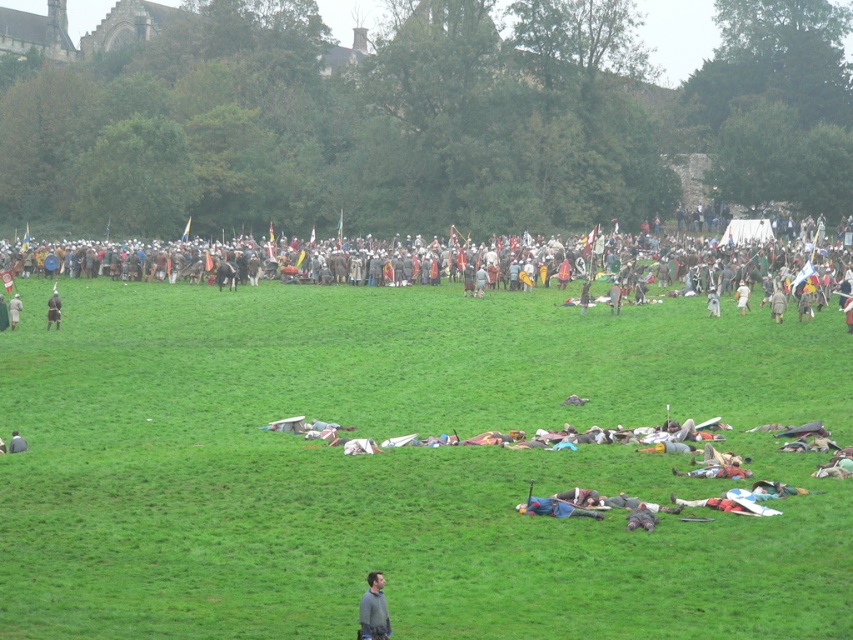
Question: Which object is farther from the camera taking this photo?

Choices:
 (A) matte black helmet at left
 (B) dark gray fabric helmet at center
 (C) gray fabric shirt at lower center

Answer: (A)

Question: Can you confirm if green grass at center is positioned to the left of matte black helmet at left?

Choices:
 (A) no
 (B) yes

Answer: (A)

Question: Is gray fabric shirt at lower center thinner than matte black helmet at left?

Choices:
 (A) no
 (B) yes

Answer: (B)

Question: In this image, where is gray fabric shirt at lower center located relative to dark gray fabric helmet at center?

Choices:
 (A) left
 (B) right

Answer: (B)

Question: Which of these objects is positioned farthest from the matte black helmet at left?

Choices:
 (A) gray fabric shirt at lower center
 (B) metallic armor at center

Answer: (A)

Question: Estimate the real-world distances between objects in this image. Which object is closer to the metallic armor at center?

Choices:
 (A) matte black helmet at left
 (B) gray fabric shirt at lower center

Answer: (A)